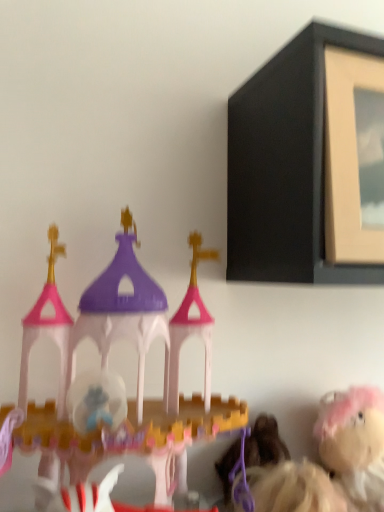
Question: Does matte plastic castle at left, which is the 1th toy from front to back, appear on the left side of fluffy pink plush at lower right, which is the 2th toy from front to back?

Choices:
 (A) yes
 (B) no

Answer: (A)

Question: Is matte plastic castle at left, which is the 1th toy from front to back, not within fluffy pink plush at lower right, the 1th toy positioned from the back?

Choices:
 (A) yes
 (B) no

Answer: (A)

Question: Can you confirm if matte plastic castle at left, which is the 1th toy from front to back, is shorter than fluffy pink plush at lower right, which is the 2th toy in left-to-right order?

Choices:
 (A) no
 (B) yes

Answer: (A)

Question: Does matte plastic castle at left, the 2th toy from the right, appear on the right side of fluffy pink plush at lower right, which is the 2th toy in left-to-right order?

Choices:
 (A) no
 (B) yes

Answer: (A)

Question: Would you say matte plastic castle at left, arranged as the 2th toy when viewed from the back, contains fluffy pink plush at lower right, which is the 2th toy from front to back?

Choices:
 (A) no
 (B) yes

Answer: (A)

Question: Is matte plastic castle at left, which is the 1th toy from front to back, smaller than fluffy pink plush at lower right, the 1th toy positioned from the back?

Choices:
 (A) yes
 (B) no

Answer: (B)

Question: Is matte plastic castle at left, which is the 1th toy from front to back, taller than matte black picture frame at upper right?

Choices:
 (A) no
 (B) yes

Answer: (B)

Question: Are matte plastic castle at left, which is the 1th toy from front to back, and matte black picture frame at upper right beside each other?

Choices:
 (A) yes
 (B) no

Answer: (B)

Question: From a real-world perspective, does matte plastic castle at left, arranged as the 1th toy when viewed from the left, stand above matte black picture frame at upper right?

Choices:
 (A) no
 (B) yes

Answer: (A)

Question: Considering the relative positions of matte plastic castle at left, arranged as the 2th toy when viewed from the back, and matte black picture frame at upper right in the image provided, is matte plastic castle at left, arranged as the 2th toy when viewed from the back, to the left of matte black picture frame at upper right from the viewer's perspective?

Choices:
 (A) yes
 (B) no

Answer: (A)

Question: Can you confirm if matte plastic castle at left, arranged as the 2th toy when viewed from the back, is positioned to the right of matte black picture frame at upper right?

Choices:
 (A) yes
 (B) no

Answer: (B)

Question: Is the depth of matte plastic castle at left, arranged as the 1th toy when viewed from the left, less than that of matte black picture frame at upper right?

Choices:
 (A) no
 (B) yes

Answer: (B)

Question: Is matte black picture frame at upper right further to camera compared to matte plastic castle at left, arranged as the 1th toy when viewed from the left?

Choices:
 (A) yes
 (B) no

Answer: (A)